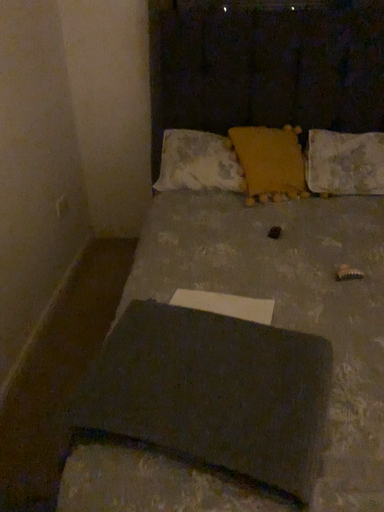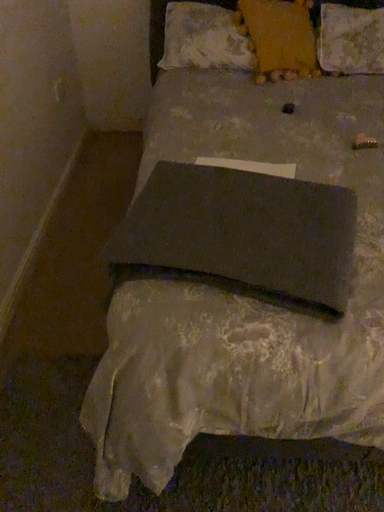
Question: How did the camera likely rotate when shooting the video?

Choices:
 (A) rotated downward
 (B) rotated upward

Answer: (A)